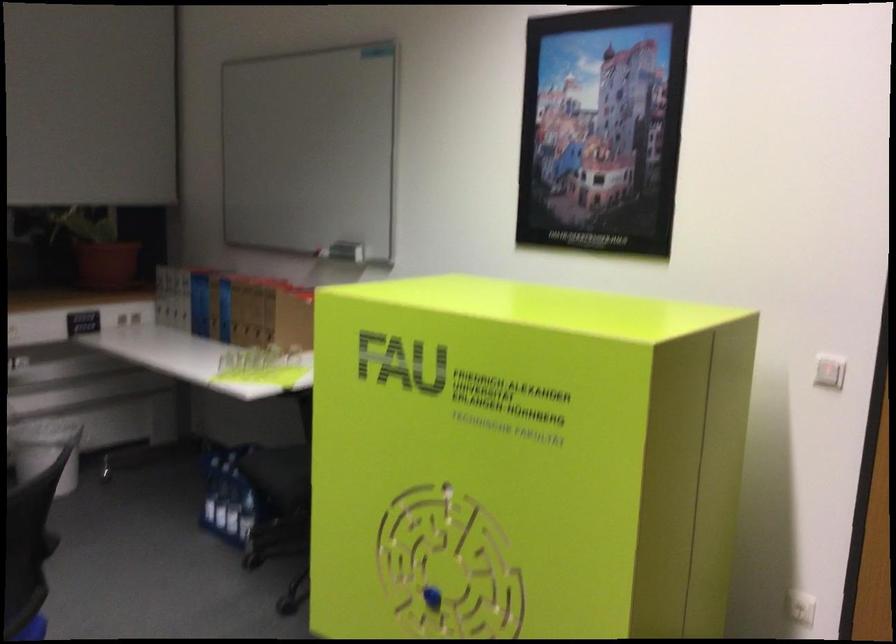
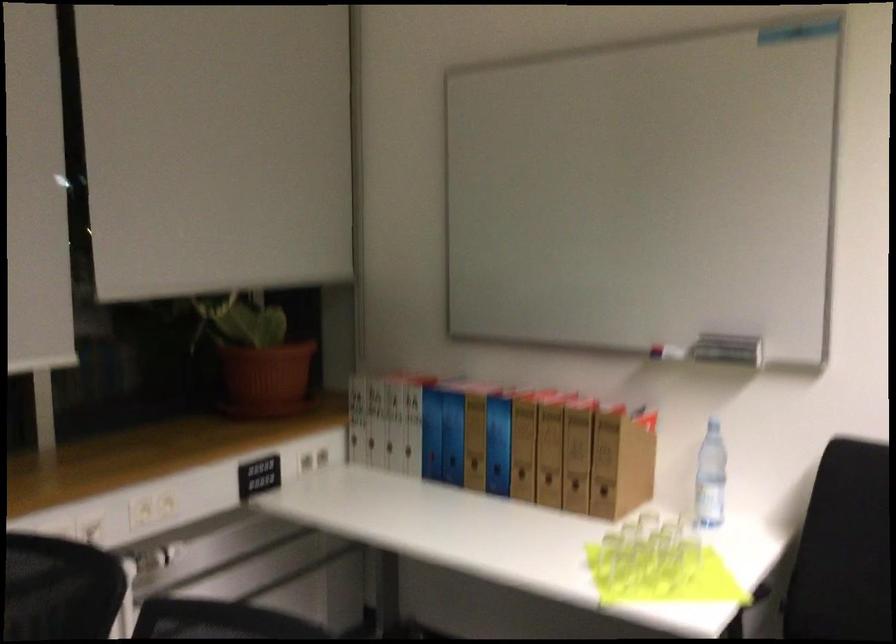
What movement of the cameraman would produce the second image?

The movement direction of the cameraman is left, forward.